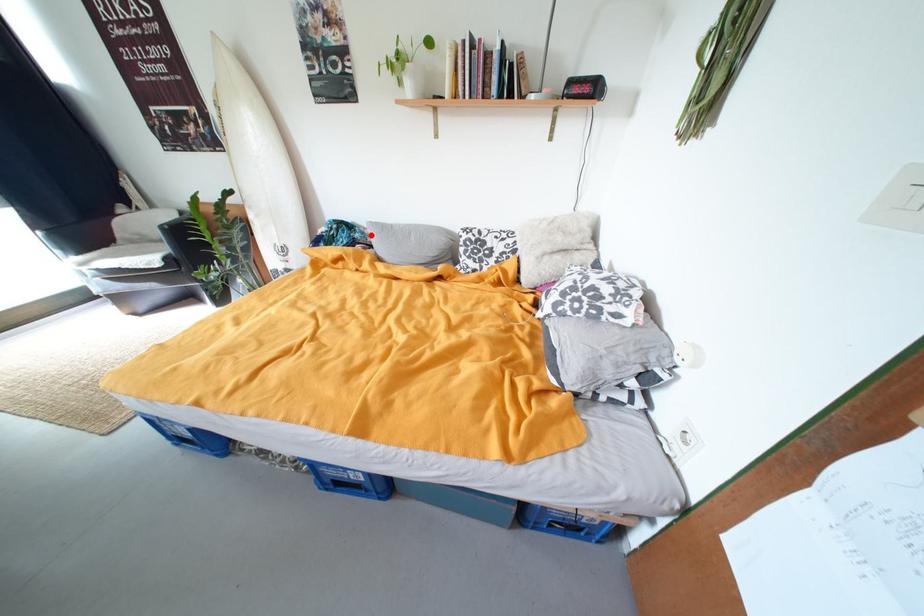
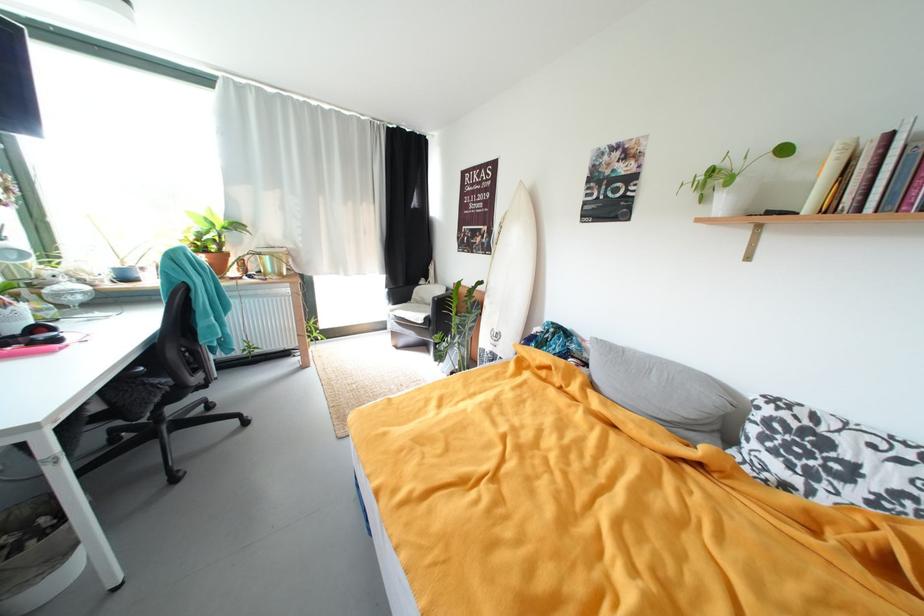
Where in the second image is the point corresponding to the highlighted location from the first image?

(588, 347)